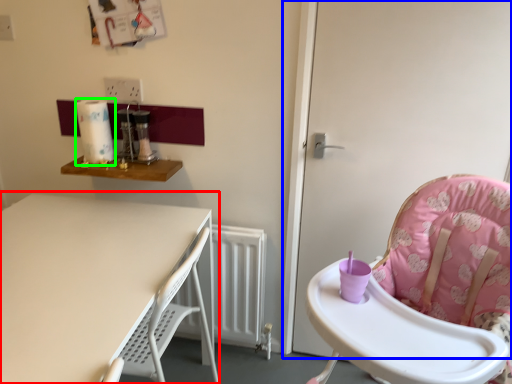
Question: Based on their relative distances, which object is nearer to table (highlighted by a red box)? Choose from screen door (highlighted by a blue box) and paper towel (highlighted by a green box).

Choices:
 (A) screen door
 (B) paper towel

Answer: (B)